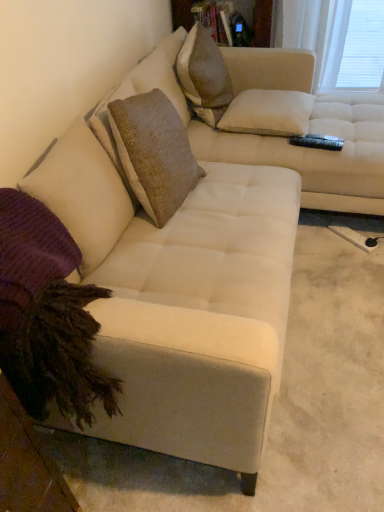
Question: Looking at their shapes, would you say white textured pillow at upper center, the second pillow viewed from the left, is wider or thinner than textured beige pillow at upper center?

Choices:
 (A) thin
 (B) wide

Answer: (B)

Question: Is white textured pillow at upper center, the second pillow viewed from the left, situated inside textured beige pillow at upper center or outside?

Choices:
 (A) inside
 (B) outside

Answer: (B)

Question: Considering the real-world distances, which object is closest to the white matte window screen at upper right?

Choices:
 (A) purple knitted pillow at lower left, arranged as the 2th pillow when viewed from the right
 (B) white textured pillow at upper center, the second pillow in the bottom-to-top sequence
 (C) textured beige pillow at upper center

Answer: (B)

Question: Which of these objects is positioned closest to the white textured pillow at upper center, marked as the first pillow in a top-to-bottom arrangement?

Choices:
 (A) white matte window screen at upper right
 (B) textured beige pillow at upper center
 (C) purple knitted pillow at lower left, which appears as the 2th pillow when viewed from the back

Answer: (B)